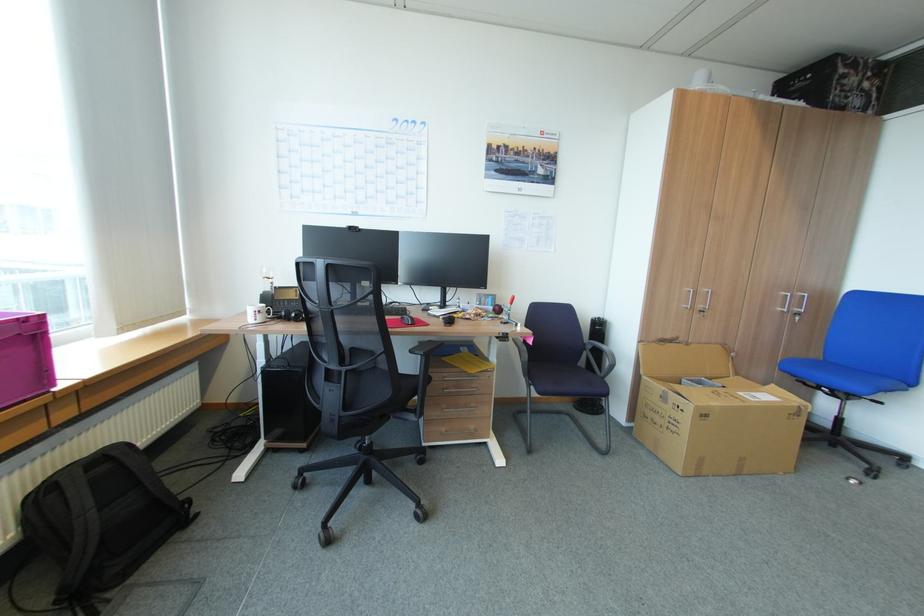
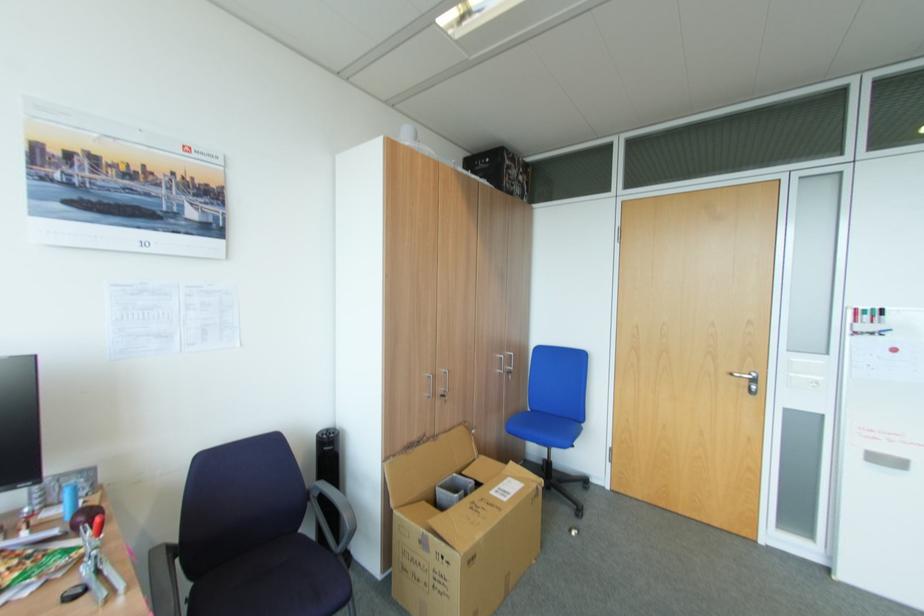
Locate, in the second image, the point that corresponds to (x=698, y=307) in the first image.

(440, 394)